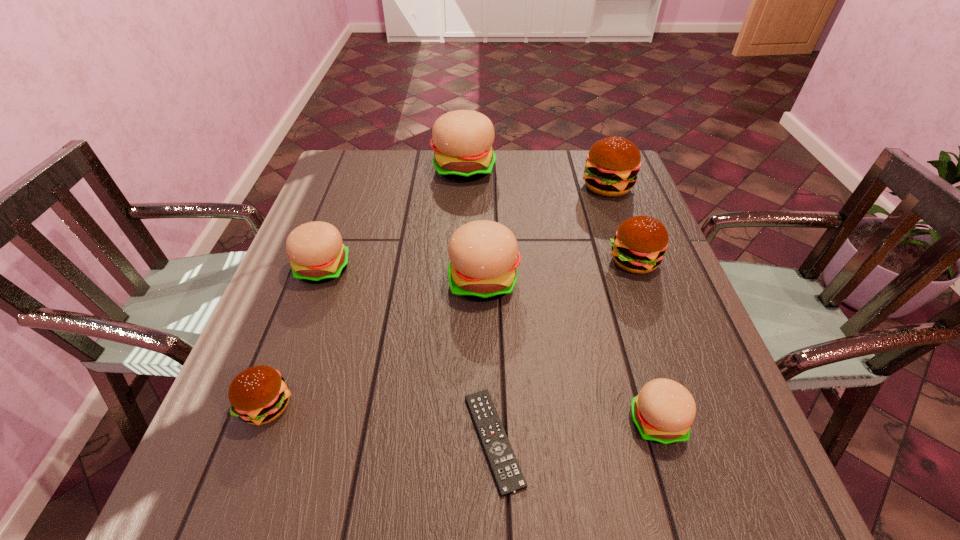
You are a GUI agent. You are given a task and a screenshot of the screen. Output one action in this format:
    pyautogui.click(x=<x>, y=<y>)
    Task: Click on the vacant space located on the front of the biggest beige hamburger
    The width and height of the screenshot is (960, 540).
    Given the screenshot: What is the action you would take?
    pyautogui.click(x=460, y=253)

Locate an element on the screen. The image size is (960, 540). free space located 0.350m on the left of the biggest brown hamburger is located at coordinates (461, 186).

Where is `vacant space positioned 0.200m on the left of the second biggest beige hamburger`? This screenshot has width=960, height=540. vacant space positioned 0.200m on the left of the second biggest beige hamburger is located at coordinates (362, 281).

The image size is (960, 540). I want to click on blank space located on the left of the second nearest brown hamburger, so click(x=545, y=261).

This screenshot has width=960, height=540. In order to click on vacant area situated 0.180m on the front of the leftmost beige hamburger in this screenshot , I will do `click(292, 353)`.

Image resolution: width=960 pixels, height=540 pixels. What are the coordinates of `free location located 0.090m on the front of the leftmost brown hamburger` in the screenshot? It's located at (237, 485).

At what (x,y) coordinates should I click in order to perform the action: click on free region located 0.090m on the front of the rightmost beige hamburger. Please return your answer as a coordinate pair (x, y). Looking at the image, I should click on (682, 506).

The image size is (960, 540). What are the coordinates of `vacant region located on the back of the remote control` in the screenshot? It's located at (492, 340).

Image resolution: width=960 pixels, height=540 pixels. What are the coordinates of `object present at the near edge` in the screenshot? It's located at (508, 476).

Locate an element on the screen. The width and height of the screenshot is (960, 540). object that is at the far right corner is located at coordinates (612, 164).